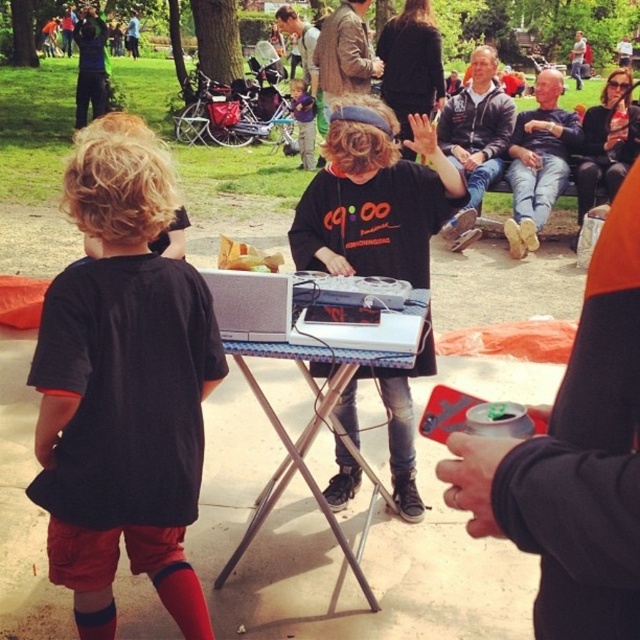
Question: Which object is closer to the camera taking this photo?

Choices:
 (A) metallic silver table at center
 (B) matte purple shirt at center
 (C) black matte shirt at center

Answer: (A)

Question: Is brown leather jacket at upper center below matte purple shirt at center?

Choices:
 (A) no
 (B) yes

Answer: (B)

Question: Does metallic silver table at center have a smaller size compared to dark gray hoodie at center?

Choices:
 (A) no
 (B) yes

Answer: (B)

Question: Which point is closer to the camera?

Choices:
 (A) (371, 602)
 (B) (132, 326)

Answer: (B)

Question: Is black matte shirt at center bigger than brown leather jacket at upper center?

Choices:
 (A) no
 (B) yes

Answer: (A)

Question: Based on their relative distances, which object is nearer to the matte purple shirt at center?

Choices:
 (A) denim jeans at center
 (B) dark gray hoodie at center
 (C) metallic silver table at center

Answer: (B)